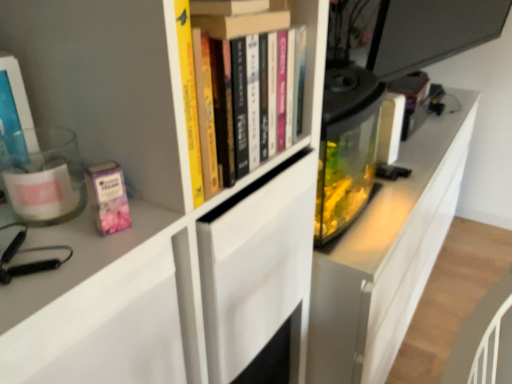
Question: From a real-world perspective, is pink matte paperback book at left above or below translucent plastic container at left, acting as the 1th book starting from the left?

Choices:
 (A) below
 (B) above

Answer: (A)

Question: Is pink matte paperback book at left inside the boundaries of translucent plastic container at left, which is the second book from right to left, or outside?

Choices:
 (A) outside
 (B) inside

Answer: (A)

Question: Which is nearer to the pink matte paperback book at left?

Choices:
 (A) translucent plastic container at left, acting as the 1th book starting from the left
 (B) hardcover books at upper center, positioned as the 1th book in right-to-left order

Answer: (A)

Question: Which is farther from the pink matte paperback book at left?

Choices:
 (A) hardcover books at upper center, positioned as the 1th book in right-to-left order
 (B) translucent plastic container at left, which is the second book from right to left

Answer: (A)